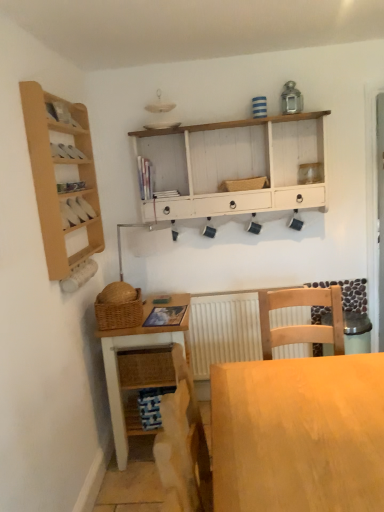
Question: From a real-world perspective, relative to white textured radiator at center, is light wood desk at center vertically above or below?

Choices:
 (A) above
 (B) below

Answer: (B)

Question: Considering the positions of light wood desk at center and white textured radiator at center in the image, is light wood desk at center wider or thinner than white textured radiator at center?

Choices:
 (A) thin
 (B) wide

Answer: (B)

Question: Considering the real-world distances, which object is closest to the light wood shelf at left?

Choices:
 (A) white textured radiator at center
 (B) wooden table at lower center
 (C) woven straw basket at center
 (D) woven brown picnic basket at lower left
 (E) light wood desk at center

Answer: (D)

Question: Which is farther from the wooden table at lower center?

Choices:
 (A) light wood shelf at left
 (B) white textured radiator at center
 (C) wooden cabinet at left
 (D) white painted wood cabinet at upper center
 (E) woven straw basket at center

Answer: (E)